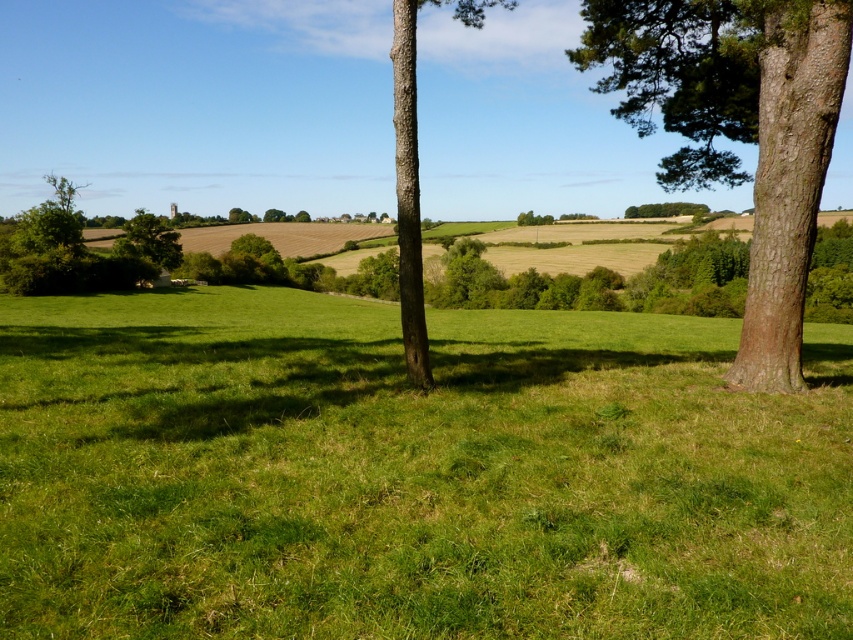
You are a gardener planning to plant flowers in the green grass at center and the green leafy tree at left. If you want to plant flowers in the area with more space, which location should you choose?

The green grass at center is larger in size than the green leafy tree at left, so you should plant flowers in the green grass at center.